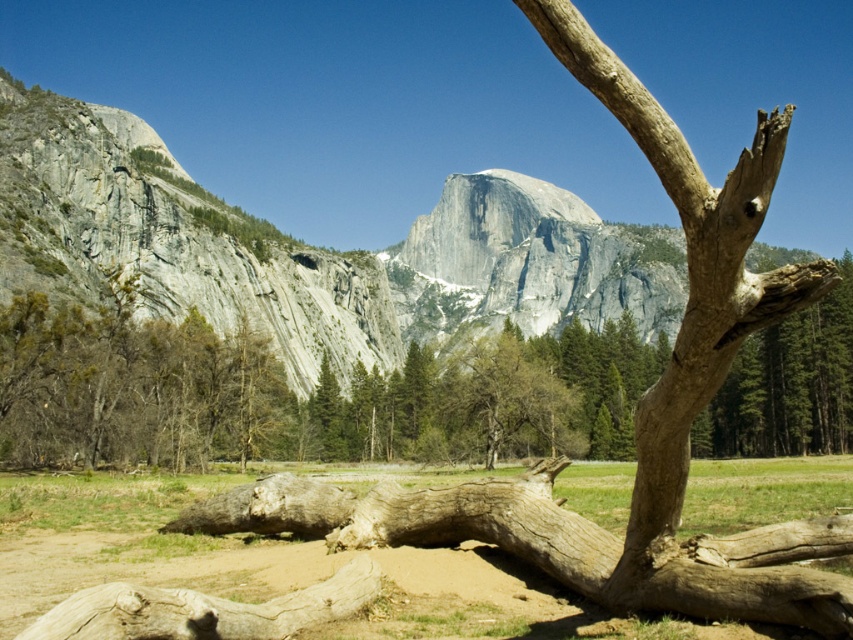
You are standing at the base of the mountain range and notice the brown dirt field at lower center. According to the coordinates provided, where exactly is the brown dirt field located in relation to your position?

The brown dirt field at lower center is located at point coordinates of (404, 560), which means it is positioned to the right and slightly above your current viewpoint.

You are planning to set up a small tent in the brown dirt field at lower center and the brown rough log at lower left. Which location would allow you to place a larger tent due to having more space?

The brown dirt field at lower center has a larger width than the brown rough log at lower left, so you can place a larger tent there.